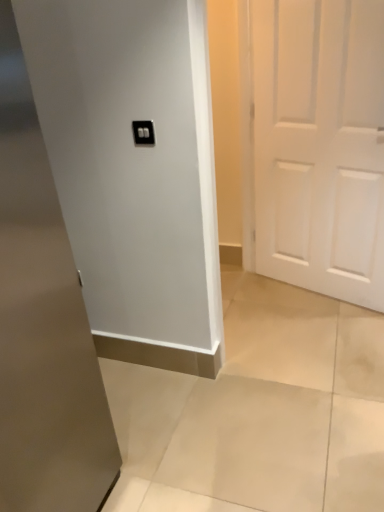
Question: Considering the relative sizes of black plastic light switch at upper center and white matte door at right, which is the second door from left to right, in the image provided, is black plastic light switch at upper center shorter than white matte door at right, which is the second door from left to right,?

Choices:
 (A) no
 (B) yes

Answer: (B)

Question: Can you see black plastic light switch at upper center touching white matte door at right, placed as the 1th door when sorted from right to left?

Choices:
 (A) yes
 (B) no

Answer: (B)

Question: Can you confirm if black plastic light switch at upper center is positioned to the left of white matte door at right, arranged as the second door when viewed from the front?

Choices:
 (A) no
 (B) yes

Answer: (B)

Question: Does black plastic light switch at upper center have a greater height compared to white matte door at right, placed as the 1th door when sorted from right to left?

Choices:
 (A) yes
 (B) no

Answer: (B)

Question: Is black plastic light switch at upper center smaller than white matte door at right, which is the second door from left to right?

Choices:
 (A) yes
 (B) no

Answer: (A)

Question: From the image's perspective, is black plastic light switch at upper center on top of white matte door at right, placed as the 1th door when sorted from right to left?

Choices:
 (A) no
 (B) yes

Answer: (A)

Question: Are white glossy door at center, the first door viewed from the front, and black plastic light switch at upper center far apart?

Choices:
 (A) yes
 (B) no

Answer: (B)

Question: Considering the relative sizes of white glossy door at center, the second door when ordered from back to front, and black plastic light switch at upper center in the image provided, is white glossy door at center, the second door when ordered from back to front, wider than black plastic light switch at upper center?

Choices:
 (A) no
 (B) yes

Answer: (B)

Question: From the image's perspective, is white glossy door at center, the second door when ordered from back to front, beneath black plastic light switch at upper center?

Choices:
 (A) yes
 (B) no

Answer: (A)

Question: Does white glossy door at center, the first door viewed from the front, touch black plastic light switch at upper center?

Choices:
 (A) no
 (B) yes

Answer: (A)

Question: From the image's perspective, would you say white glossy door at center, the second door when ordered from back to front, is positioned over black plastic light switch at upper center?

Choices:
 (A) yes
 (B) no

Answer: (B)

Question: Considering the relative positions of white glossy door at center, the second door when ordered from back to front, and black plastic light switch at upper center in the image provided, is white glossy door at center, the second door when ordered from back to front, in front of black plastic light switch at upper center?

Choices:
 (A) no
 (B) yes

Answer: (B)

Question: Can you confirm if white matte door at right, acting as the first door starting from the back, is thinner than black plastic light switch at upper center?

Choices:
 (A) no
 (B) yes

Answer: (A)